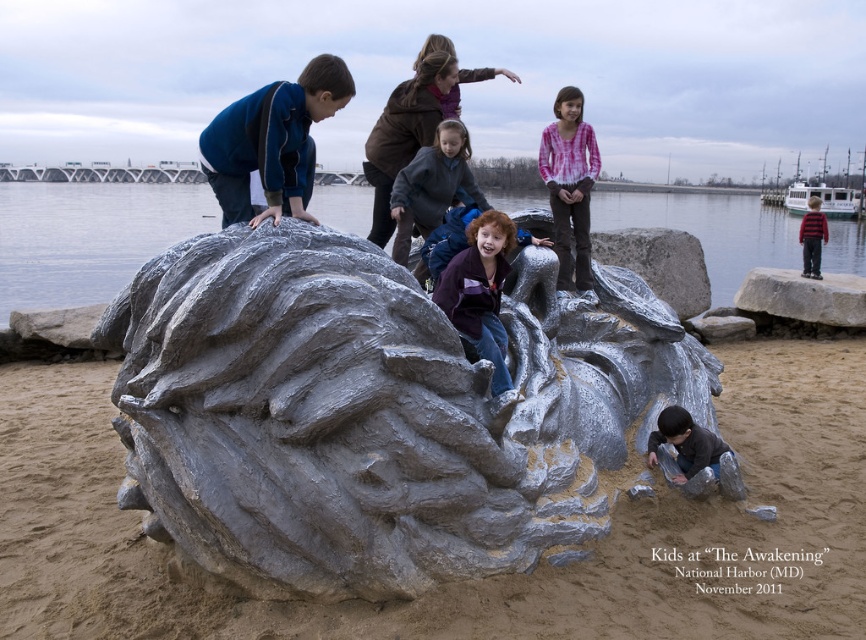
This screenshot has height=640, width=866. Describe the element at coordinates (684, 444) in the screenshot. I see `brushed metal sculpture at lower right` at that location.

Find the location of `brushed metal sculpture at lower right`. brushed metal sculpture at lower right is located at coordinates (684, 444).

Image resolution: width=866 pixels, height=640 pixels. What do you see at coordinates (684, 444) in the screenshot? I see `brushed metal sculpture at lower right` at bounding box center [684, 444].

At what (x,y) coordinates should I click in order to perform the action: click on brushed metal sculpture at lower right. Please return your answer as a coordinate pair (x, y). The image size is (866, 640). Looking at the image, I should click on (684, 444).

Does matte brown jacket at upper center have a lesser height compared to brushed metal sculpture at lower right?

No.

Is matte brown jacket at upper center positioned behind brushed metal sculpture at lower right?

Yes, it is behind brushed metal sculpture at lower right.

Describe the element at coordinates (414, 122) in the screenshot. The image size is (866, 640). I see `matte brown jacket at upper center` at that location.

Where is `matte brown jacket at upper center`? matte brown jacket at upper center is located at coordinates (414, 122).

Which is below, gray stone sculpture at center or matte gray jacket at center?

gray stone sculpture at center is below.

What do you see at coordinates (378, 412) in the screenshot? The image size is (866, 640). I see `gray stone sculpture at center` at bounding box center [378, 412].

Where is `gray stone sculpture at center`? Image resolution: width=866 pixels, height=640 pixels. gray stone sculpture at center is located at coordinates (378, 412).